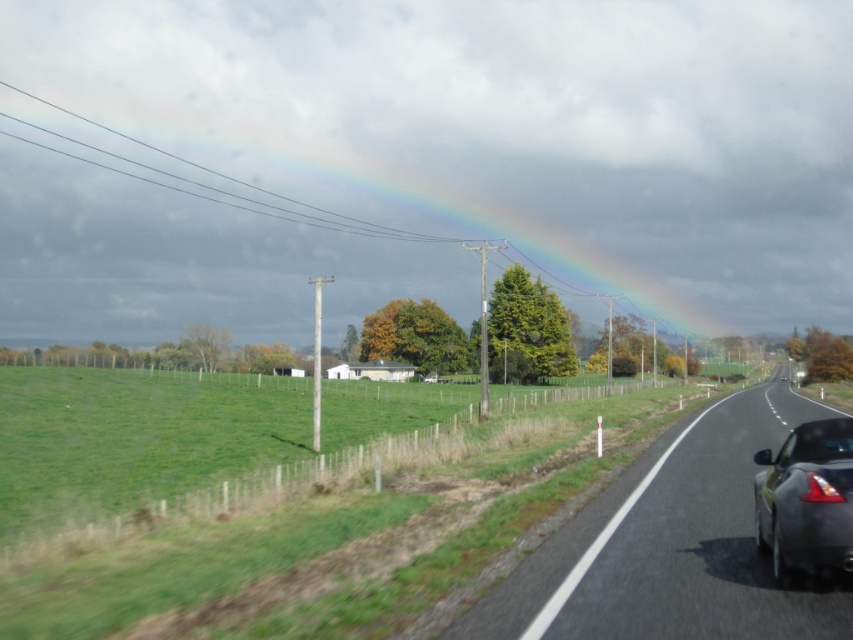
Is rainbow at upper center below transparent glass car window at right?

Incorrect, rainbow at upper center is not positioned below transparent glass car window at right.

Which is in front, point (12, 282) or point (784, 451)?

Point (784, 451) is in front.

What do you see at coordinates (221, 188) in the screenshot?
I see `rainbow at upper center` at bounding box center [221, 188].

This screenshot has width=853, height=640. What are the coordinates of `rainbow at upper center` in the screenshot? It's located at (221, 188).

Does shiny metallic car at right appear on the right side of rainbow at upper center?

Indeed, shiny metallic car at right is positioned on the right side of rainbow at upper center.

Is point (816, 429) positioned behind point (49, 278)?

No, it is in front of (49, 278).

In order to click on shiny metallic car at right in this screenshot , I will do `click(805, 499)`.

Who is shorter, asphalt road at center or rainbow at upper center?

asphalt road at center

Does point (573, 612) lie behind point (79, 282)?

No, it is not.

Image resolution: width=853 pixels, height=640 pixels. I want to click on asphalt road at center, so click(x=669, y=547).